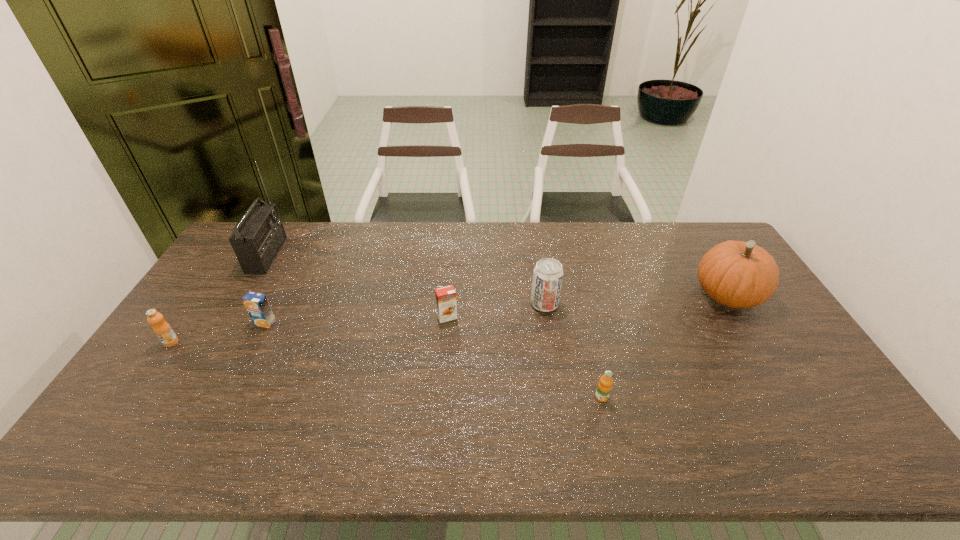
In order to click on the nearest object in this screenshot , I will do `click(604, 386)`.

Identify the location of the nearest orange juice. The image size is (960, 540). (604, 386).

Where is `vacant space located on the front panel of the tallest object`? This screenshot has height=540, width=960. vacant space located on the front panel of the tallest object is located at coordinates (348, 255).

In order to click on free space located on the stem of the second tallest object in this screenshot , I will do `click(671, 295)`.

Where is `vacant area located on the stem of the second tallest object`? vacant area located on the stem of the second tallest object is located at coordinates [599, 295].

The height and width of the screenshot is (540, 960). Identify the location of free point located on the stem of the second tallest object. (671, 295).

This screenshot has height=540, width=960. Find the location of `free point located 0.080m on the left of the soda can`. free point located 0.080m on the left of the soda can is located at coordinates (505, 303).

In order to click on free region located 0.220m on the front label of the sixth farthest object in this screenshot , I will do `click(120, 416)`.

Find the location of a particular element. vacant space located 0.300m on the left of the third orange juice from left to right is located at coordinates (339, 317).

Find the location of a particular element. This screenshot has width=960, height=540. blank space located on the right of the fifth object from right to left is located at coordinates (305, 323).